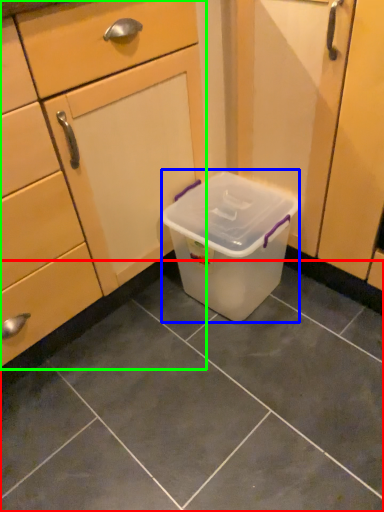
Question: Based on their relative distances, which object is farther from tile (highlighted by a red box)? Choose from storage box (highlighted by a blue box) and cabinetry (highlighted by a green box).

Choices:
 (A) storage box
 (B) cabinetry

Answer: (B)